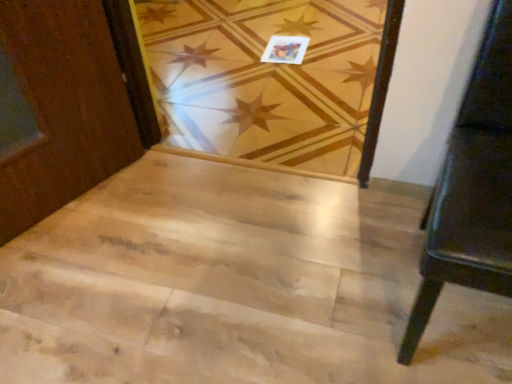
In order to face black leather bench at right, should I rotate leftwards or rightwards?

Turn right by 30.658 degrees to look at black leather bench at right.

Where is `black leather bench at right`? black leather bench at right is located at coordinates (472, 188).

Locate an element on the screen. This screenshot has width=512, height=384. furniture that appears on the right of natural wood floor at center is located at coordinates (472, 188).

Is natural wood floor at center aimed at black leather bench at right?

No, natural wood floor at center is not facing towards black leather bench at right.

Does natural wood floor at center have a lesser width compared to black leather bench at right?

No.

Is point (368, 166) farther from camera compared to point (510, 185)?

Yes, point (368, 166) is behind point (510, 185).

Would you say matte paper postcard at upper center is outside black leather bench at right?

Yes, matte paper postcard at upper center is located beyond the bounds of black leather bench at right.

Considering the points (294, 42) and (429, 283), which point is in front, point (294, 42) or point (429, 283)?

The point (429, 283) is in front.

Based on the photo, which is in front, matte paper postcard at upper center or black leather bench at right?

Positioned in front is black leather bench at right.

How many degrees apart are the facing directions of matte paper postcard at upper center and black leather bench at right?

matte paper postcard at upper center and black leather bench at right are facing 172 degrees away from each other.

In the scene shown: Is black leather bench at right positioned beyond the bounds of natural wood floor at center?

Absolutely, black leather bench at right is external to natural wood floor at center.

Identify the location of plank that appears below the black leather bench at right (from a real-world perspective). (273, 80).

Measure the distance between black leather bench at right and natural wood floor at center.

A distance of 3.65 feet exists between black leather bench at right and natural wood floor at center.

Is black leather bench at right aimed at natural wood floor at center?

No, black leather bench at right is not oriented towards natural wood floor at center.

Considering the sizes of objects natural wood stairwell at center and natural wood floor at center in the image provided, who is taller, natural wood stairwell at center or natural wood floor at center?

Standing taller between the two is natural wood floor at center.

Which is in front, point (344, 222) or point (345, 33)?

The point (344, 222) is in front.

From a real-world perspective, is natural wood stairwell at center positioned over natural wood floor at center based on gravity?

Yes, from a real-world perspective, natural wood stairwell at center is over natural wood floor at center

Considering the positions of objects matte paper postcard at upper center and natural wood floor at center in the image provided, who is in front, matte paper postcard at upper center or natural wood floor at center?

Positioned in front is natural wood floor at center.

I want to click on plank above the matte paper postcard at upper center (from the image's perspective), so click(x=273, y=80).

Between point (276, 43) and point (353, 144), which one is positioned in front?

The point (353, 144) is closer.

Between matte paper postcard at upper center and natural wood floor at center, which one appears on the right side from the viewer's perspective?

From the viewer's perspective, matte paper postcard at upper center appears more on the right side.

Which is closer, (494,231) or (71,205)?

The point (494,231) is closer to the camera.

Could you tell me if black leather bench at right is facing natural wood stairwell at center?

No, black leather bench at right does not turn towards natural wood stairwell at center.

From a real-world perspective, relative to natural wood stairwell at center, is black leather bench at right vertically above or below?

black leather bench at right is above natural wood stairwell at center.

Does black leather bench at right have a smaller size compared to natural wood stairwell at center?

No.

Is natural wood stairwell at center to the left of black leather bench at right from the viewer's perspective?

Yes.

Which object is closer to the camera, natural wood stairwell at center or black leather bench at right?

black leather bench at right is in front.

Which of these two, natural wood stairwell at center or black leather bench at right, is wider?

Wider between the two is natural wood stairwell at center.

Looking at this image, from a real-world perspective, does natural wood stairwell at center sit lower than black leather bench at right?

Yes, from a real-world perspective, natural wood stairwell at center is below black leather bench at right.

Identify the location of furniture below the natural wood floor at center (from the image's perspective). The width and height of the screenshot is (512, 384). (472, 188).

At what (x,y) coordinates should I click in order to perform the action: click on furniture above the matte paper postcard at upper center (from a real-world perspective). Please return your answer as a coordinate pair (x, y). This screenshot has width=512, height=384. Looking at the image, I should click on tap(472, 188).

Estimate the real-world distances between objects in this image. Which object is closer to natural wood floor at center, matte paper postcard at upper center or black leather bench at right?

matte paper postcard at upper center.

Considering their positions, is matte paper postcard at upper center positioned closer to natural wood floor at center than natural wood stairwell at center?

matte paper postcard at upper center is positioned closer to the anchor natural wood floor at center.

Looking at the image, which one is located closer to matte paper postcard at upper center, natural wood stairwell at center or black leather bench at right?

natural wood stairwell at center is closer to matte paper postcard at upper center.

Which object lies further to the anchor point matte paper postcard at upper center, black leather bench at right or natural wood stairwell at center?

Among the two, black leather bench at right is located further to matte paper postcard at upper center.

When comparing their distances from matte paper postcard at upper center, does natural wood floor at center or black leather bench at right seem closer?

Based on the image, natural wood floor at center appears to be nearer to matte paper postcard at upper center.

Looking at this image, which object lies nearer to the anchor point natural wood stairwell at center, natural wood floor at center or black leather bench at right?

black leather bench at right is closer to natural wood stairwell at center.

Looking at the image, which one is located further to black leather bench at right, matte paper postcard at upper center or natural wood stairwell at center?

matte paper postcard at upper center lies further to black leather bench at right than the other object.

Looking at the image, which one is located further to natural wood stairwell at center, matte paper postcard at upper center or natural wood floor at center?

Among the two, matte paper postcard at upper center is located further to natural wood stairwell at center.

This screenshot has height=384, width=512. Identify the location of stairwell between black leather bench at right and matte paper postcard at upper center from front to back. (234, 286).

The height and width of the screenshot is (384, 512). I want to click on plank located between natural wood stairwell at center and matte paper postcard at upper center in the depth direction, so click(x=273, y=80).

Find the location of a particular element. plank between black leather bench at right and matte paper postcard at upper center in the front-back direction is located at coordinates (273, 80).

You are a GUI agent. You are given a task and a screenshot of the screen. Output one action in this format:
    pyautogui.click(x=<x>, y=<y>)
    Task: Click on the stairwell between black leather bench at right and natural wood floor at center in the front-back direction
    The width and height of the screenshot is (512, 384).
    Given the screenshot: What is the action you would take?
    pyautogui.click(x=234, y=286)